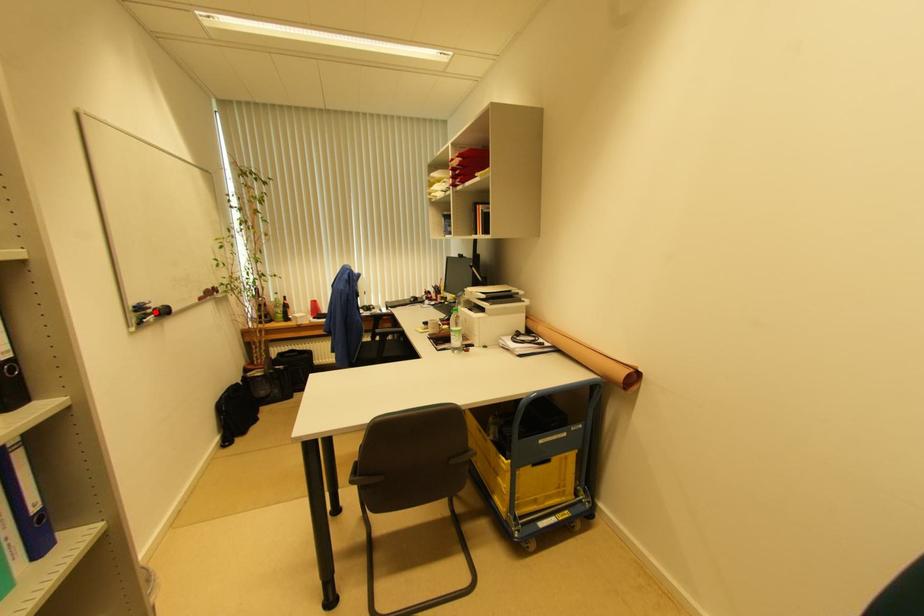
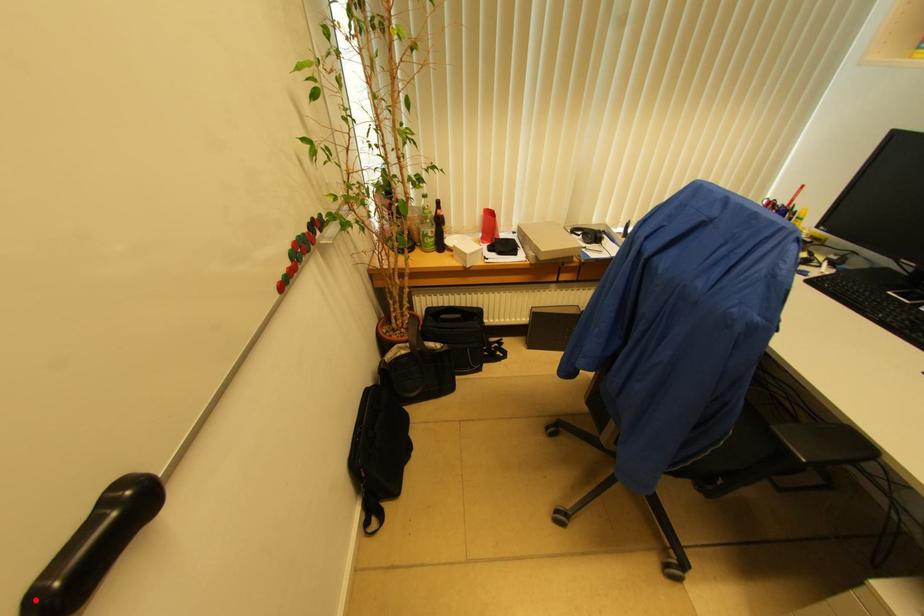
I am providing you with two images of the same scene from different viewpoints. A red point is marked on the first image and another point is marked on the second image. Is the marked point in image1 the same physical position as the marked point in image2?

Yes